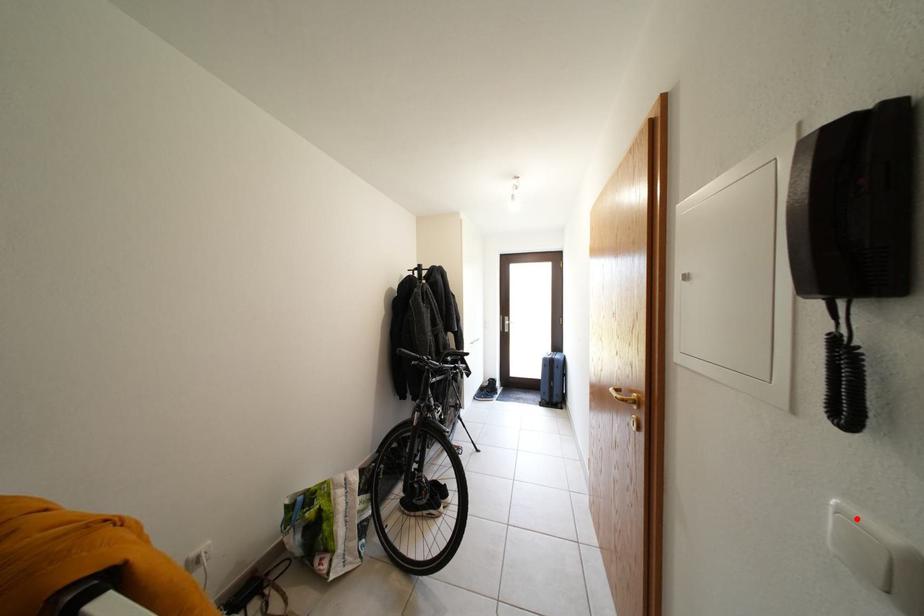
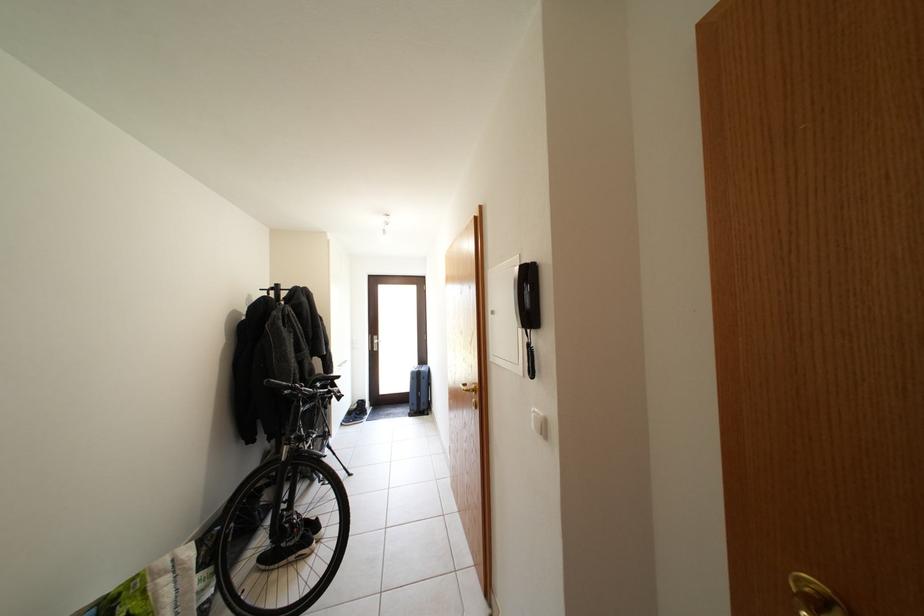
Locate, in the second image, the point that corresponds to the highlighted location in the first image.

(543, 418)